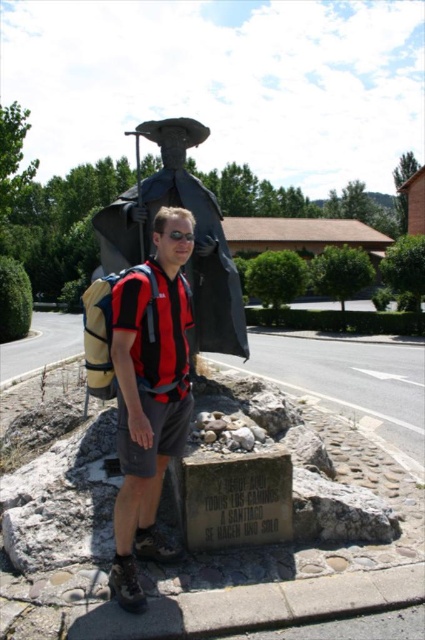
You are a photographer trying to capture the man in the scene. You notice the red and black striped shirt at center and the black plastic goggles at center. Which object is located to the left of the other?

The red and black striped shirt at center is positioned on the left side of black plastic goggles at center.

You are a photographer trying to capture both the black matte statue at upper center and the black plastic goggles at center in a single frame. Based on their sizes, which object should you focus on first to ensure both fit in the photo?

The black matte statue at upper center is taller than the black plastic goggles at center, so you should focus on the statue first to ensure both fit in the photo.